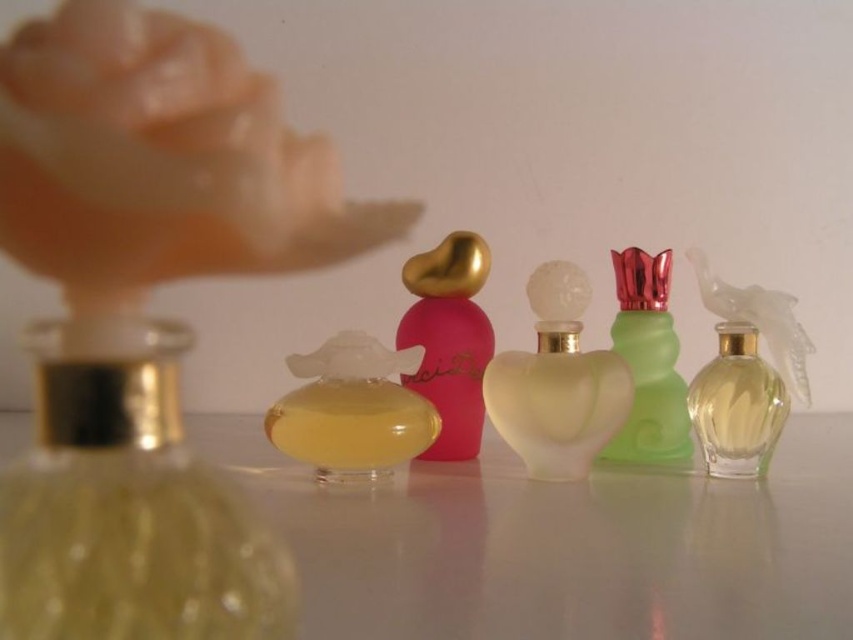
Question: Does translucent glass heart-shaped perfume at center come behind green frosted glass perfume at center right?

Choices:
 (A) yes
 (B) no

Answer: (B)

Question: Which of the following is the farthest from the observer?

Choices:
 (A) (339, 474)
 (B) (708, 419)
 (C) (556, 356)

Answer: (B)

Question: Is pink glossy perfume at center positioned in front of clear glass bottle at center-right?

Choices:
 (A) no
 (B) yes

Answer: (A)

Question: Which of the following is the farthest from the observer?

Choices:
 (A) transparent glass table at center
 (B) matte peach shell at upper left
 (C) translucent yellow glass at center
 (D) translucent glass heart-shaped perfume at center

Answer: (D)

Question: From the image, what is the correct spatial relationship of translucent yellow glass at left in relation to translucent yellow glass at center?

Choices:
 (A) above
 (B) below

Answer: (A)

Question: Which object is positioned farthest from the clear glass bottle at center-right?

Choices:
 (A) translucent yellow glass at center
 (B) green frosted glass perfume at center right

Answer: (A)